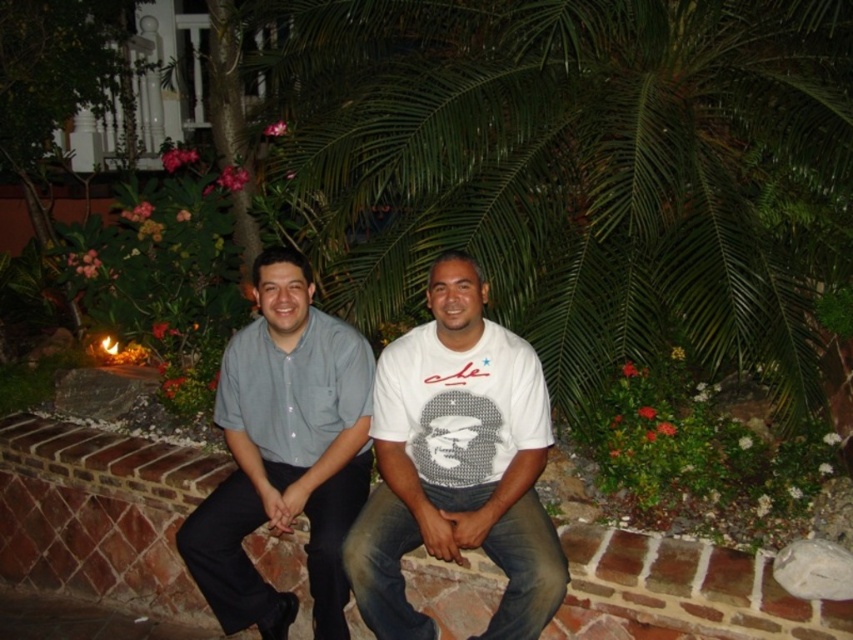
You are standing in the garden and want to take a photo of both the green leafy palm tree at center and the light blue cotton shirt at center. Which object should you position to the left side of your camera frame to include both in the photo?

To include both the green leafy palm tree at center and the light blue cotton shirt at center in the photo, position the light blue cotton shirt at center on the left side of your camera frame since the green leafy palm tree at center is to the right of it.